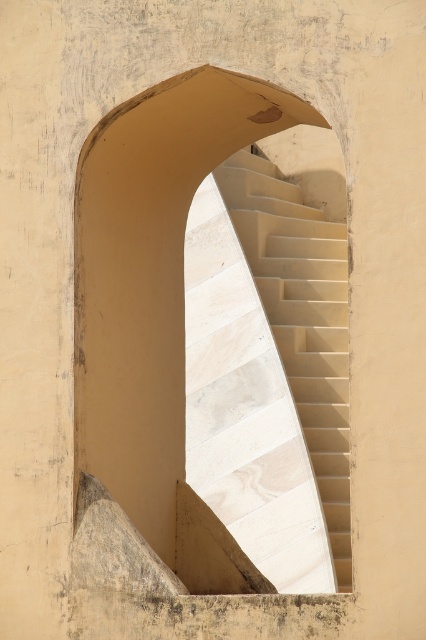
Question: Can you confirm if beige stone archway at center is thinner than beige marble stairs at center?

Choices:
 (A) yes
 (B) no

Answer: (B)

Question: Can you confirm if beige stone archway at center is wider than beige marble stairs at center?

Choices:
 (A) yes
 (B) no

Answer: (A)

Question: Is beige stone archway at center bigger than beige marble stairs at center?

Choices:
 (A) yes
 (B) no

Answer: (A)

Question: Which point is closer to the camera?

Choices:
 (A) beige marble stairs at center
 (B) beige stone archway at center

Answer: (B)

Question: Which object appears farthest from the camera in this image?

Choices:
 (A) beige stone archway at center
 (B) beige marble stairs at center

Answer: (B)